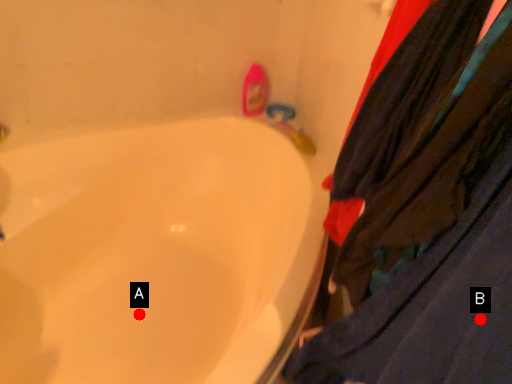
Question: Two points are circled on the image, labeled by A and B beside each circle. Which of the following is the closest to the observer?

Choices:
 (A) A is closer
 (B) B is closer

Answer: (B)